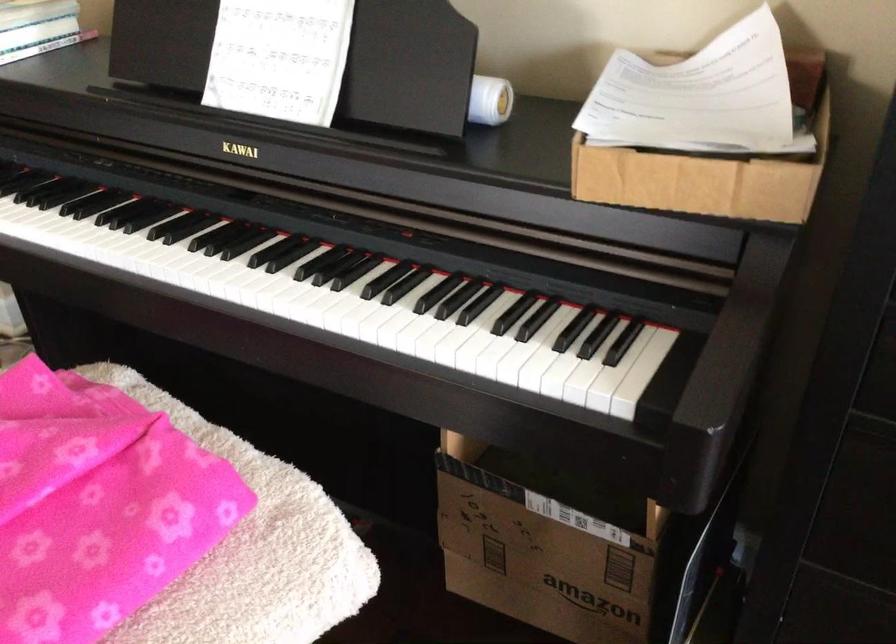
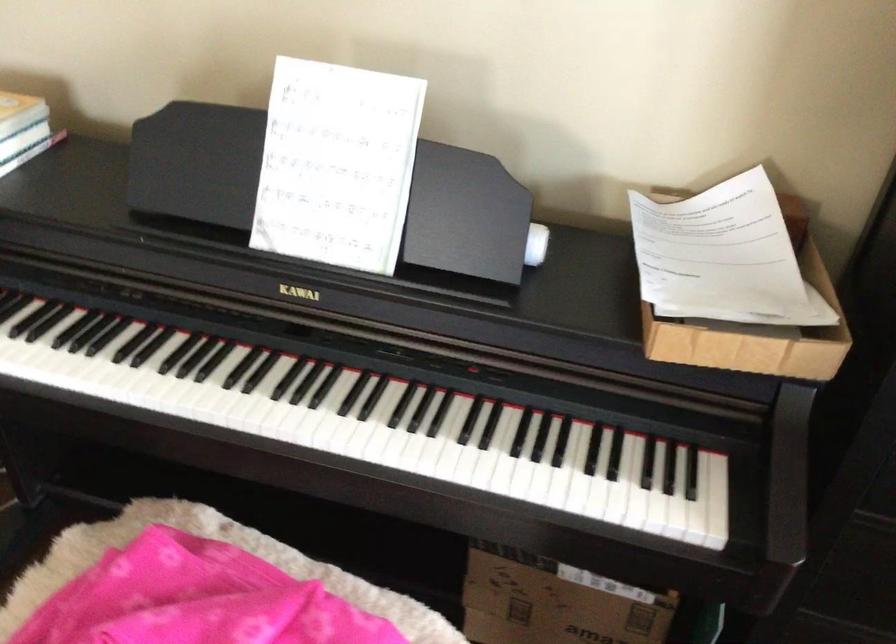
Where in the second image is the point corresponding to pixel 714 149 from the first image?

(754, 316)